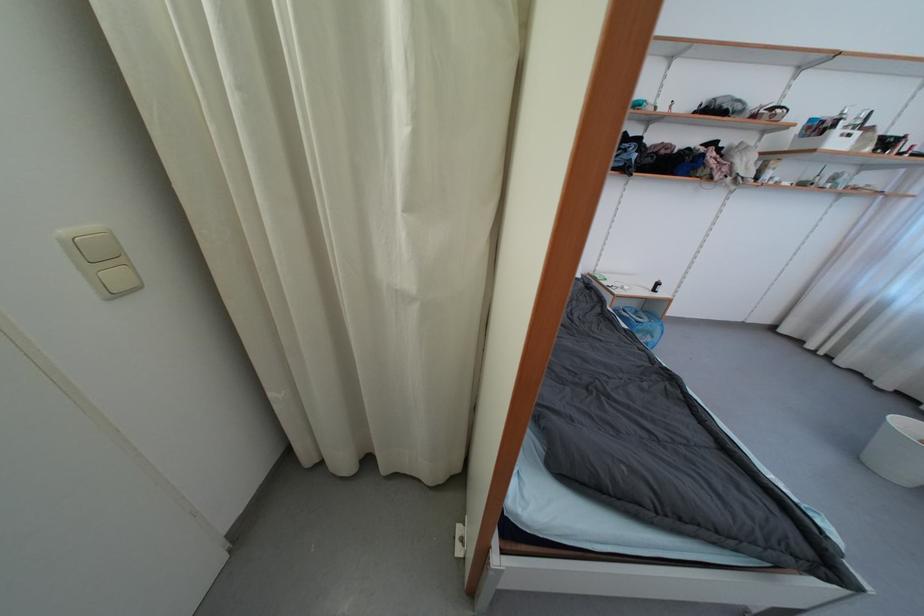
This screenshot has height=616, width=924. In order to click on small dark bottle in this screenshot , I will do `click(655, 286)`.